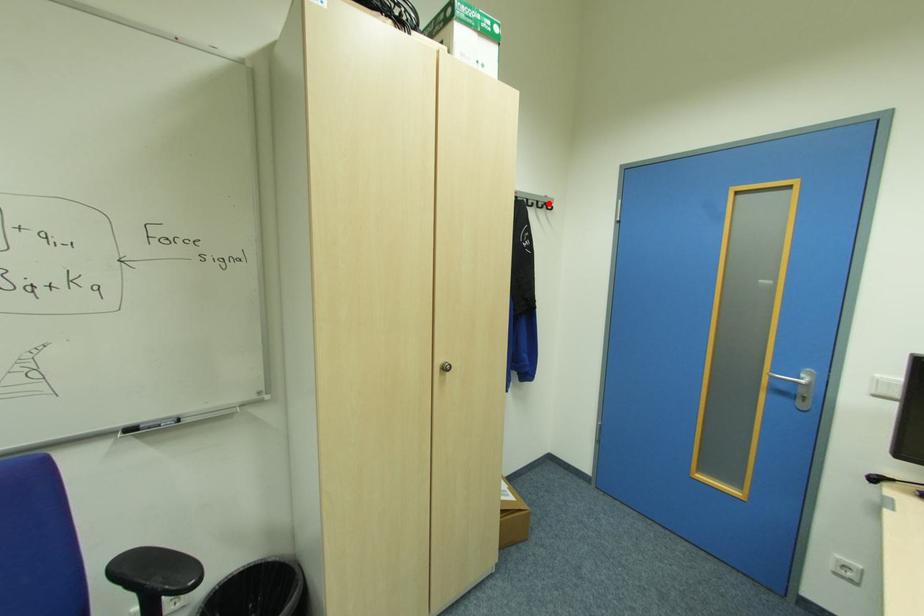
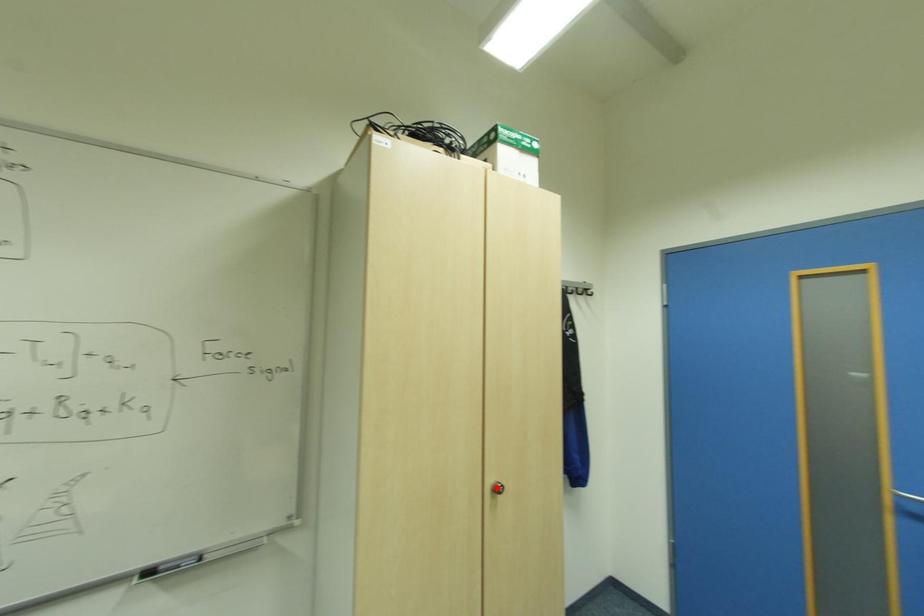
I am providing you with two images of the same scene from different viewpoints. A red point is marked on the first image and another point is marked on the second image. Does the point marked in image1 correspond to the same location as the one in image2?

No